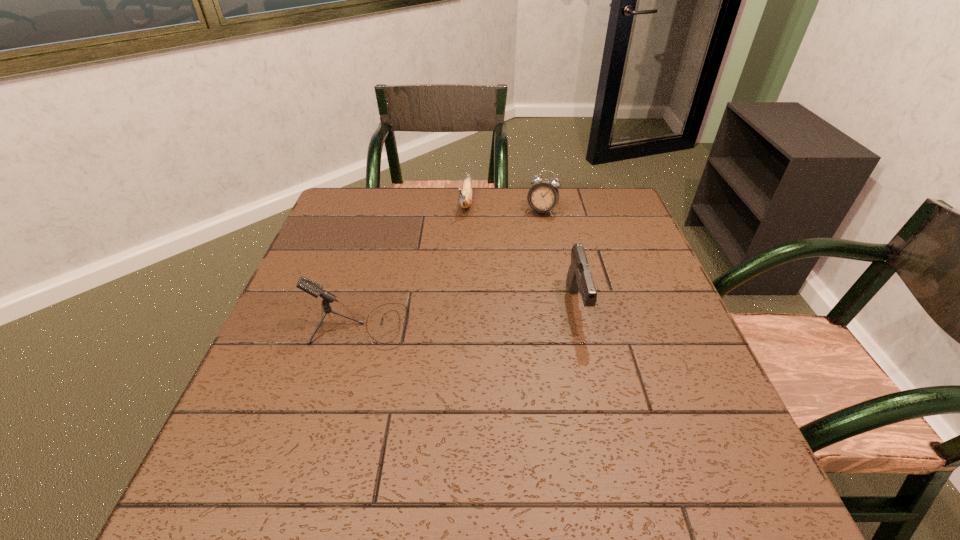
Locate an element on the screen. The height and width of the screenshot is (540, 960). vacant space that is in between the leftmost object and the pistol is located at coordinates (468, 316).

This screenshot has width=960, height=540. In order to click on vacant space that's between the alarm clock and the shortest object in this screenshot , I will do `click(504, 206)`.

Locate an element on the screen. free space between the pistol and the microphone is located at coordinates (x=468, y=316).

Locate which object ranks third in proximity to the leftmost object. Please provide its 2D coordinates. Your answer should be formatted as a tuple, i.e. [(x, y)], where the tuple contains the x and y coordinates of a point satisfying the conditions above.

[(542, 197)]

At what (x,y) coordinates should I click in order to perform the action: click on object that stands as the second closest to the pistol. Please return your answer as a coordinate pair (x, y). The width and height of the screenshot is (960, 540). Looking at the image, I should click on (465, 200).

This screenshot has height=540, width=960. Identify the location of free space that satisfies the following two spatial constraints: 1. on the front side of the alarm clock; 2. on the right side of the banana. (466, 211).